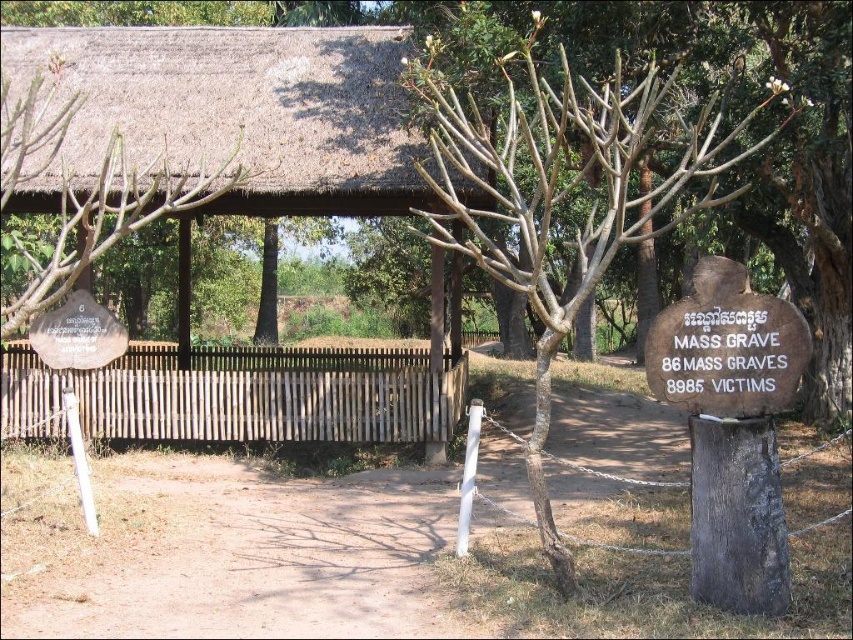
Is thatched roof hut at center positioned behind brown wooden fence at center?

That is True.

In the scene shown: Does thatched roof hut at center lie in front of brown wooden fence at center?

That is False.

Which is behind, point (386, 212) or point (366, 442)?

The point (386, 212) is more distant.

You are a GUI agent. You are given a task and a screenshot of the screen. Output one action in this format:
    pyautogui.click(x=<x>, y=<y>)
    Task: Click on the thatched roof hut at center
    Image resolution: width=853 pixels, height=640 pixels.
    Given the screenshot: What is the action you would take?
    pyautogui.click(x=231, y=113)

Who is higher up, brown bark tree at center or brown wooden fence at center?

Positioned higher is brown bark tree at center.

Is point (618, 92) positioned in front of point (35, 403)?

Yes, point (618, 92) is in front of point (35, 403).

Is point (589, 173) less distant than point (99, 376)?

Yes, point (589, 173) is in front of point (99, 376).

This screenshot has height=640, width=853. What are the coordinates of `brown bark tree at center` in the screenshot? It's located at (563, 192).

Locate an element on the screen. The width and height of the screenshot is (853, 640). thatched roof hut at center is located at coordinates (231, 113).

Does thatched roof hut at center have a lesser width compared to brown bark tree at center?

Yes.

Between point (376, 32) and point (527, 204), which one is positioned in front?

Positioned in front is point (376, 32).

In order to click on thatched roof hut at center in this screenshot , I will do 231,113.